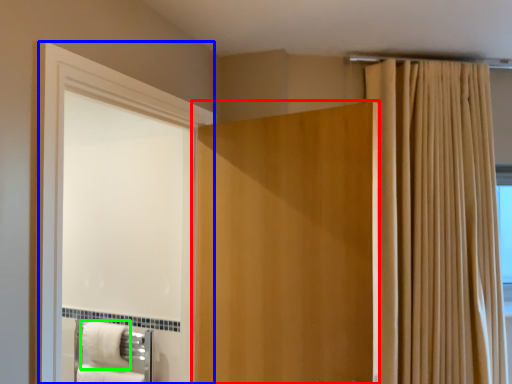
Question: Considering the real-world distances, which object is closest to door (highlighted by a red box)? screen door (highlighted by a blue box) or bath towel (highlighted by a green box).

Choices:
 (A) screen door
 (B) bath towel

Answer: (A)